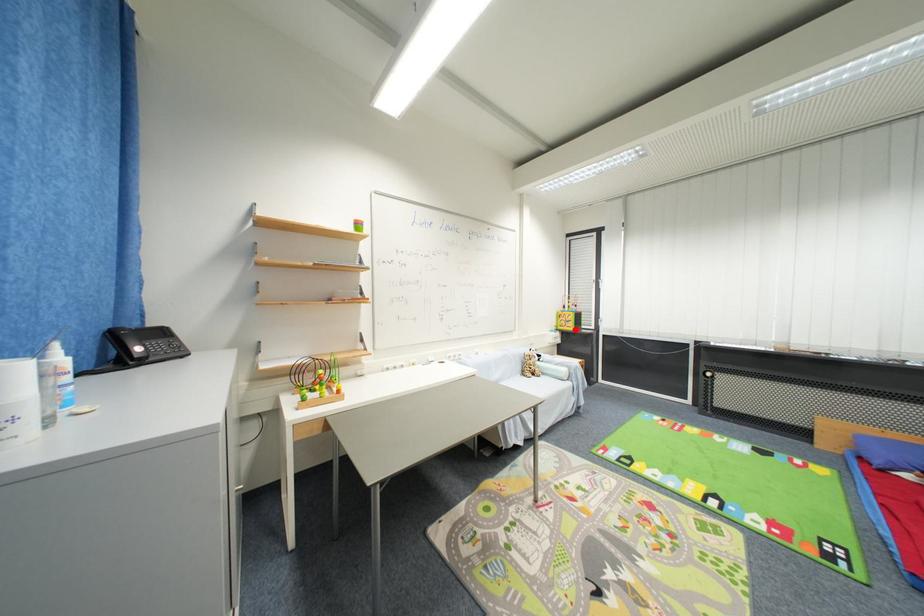
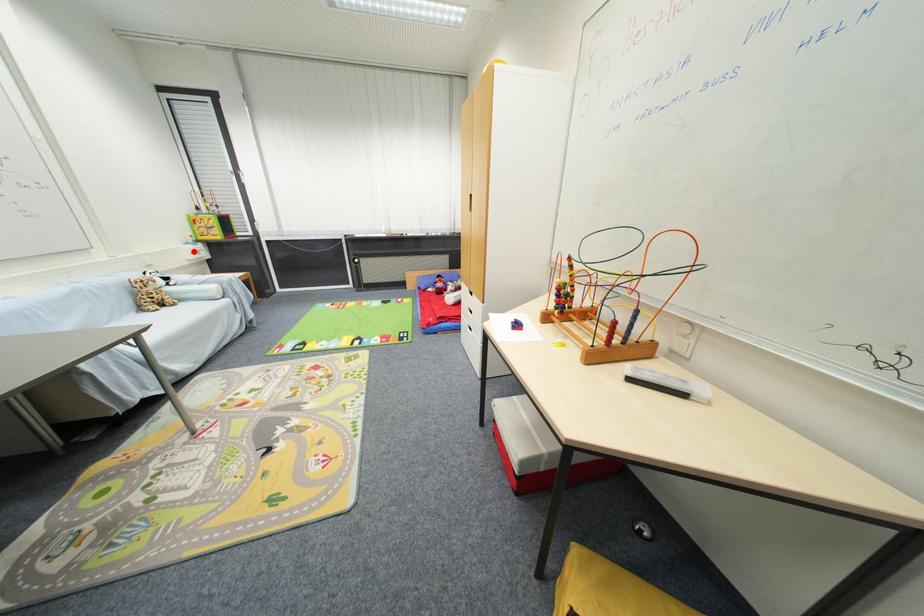
I am providing you with two images of the same scene from different viewpoints. A red point is marked on the first image and another point is marked on the second image. Do the highlighted points in image1 and image2 indicate the same real-world spot?

No